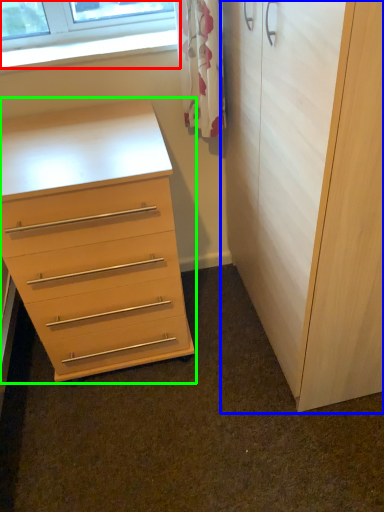
Question: Which object is the farthest from window (highlighted by a red box)? Choose among these: cupboard (highlighted by a blue box) or chest of drawers (highlighted by a green box).

Choices:
 (A) cupboard
 (B) chest of drawers

Answer: (A)